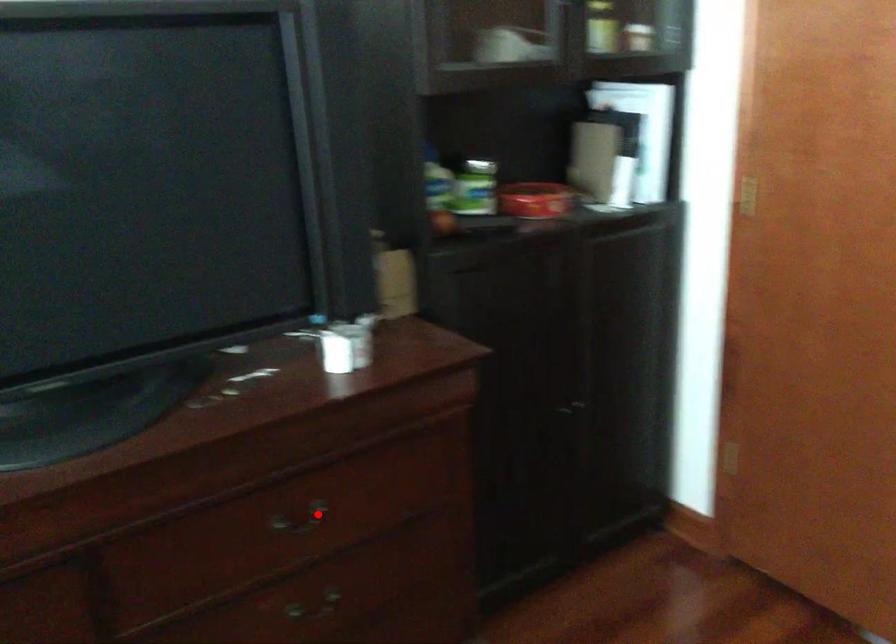
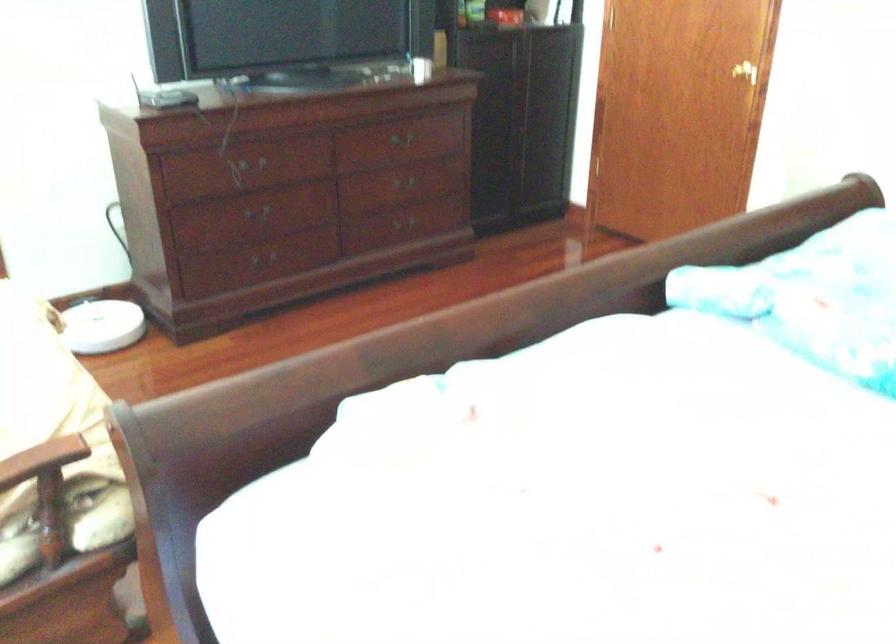
Question: I am providing you with two images of the same scene from different viewpoints. In image1, a red point is highlighted. Considering the same 3D point in image2, which of the following is correct?

Choices:
 (A) It is closer
 (B) It is farther

Answer: (B)